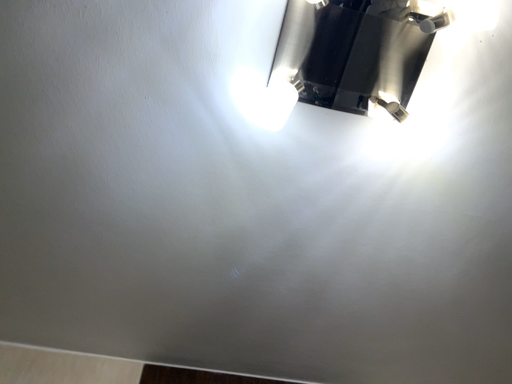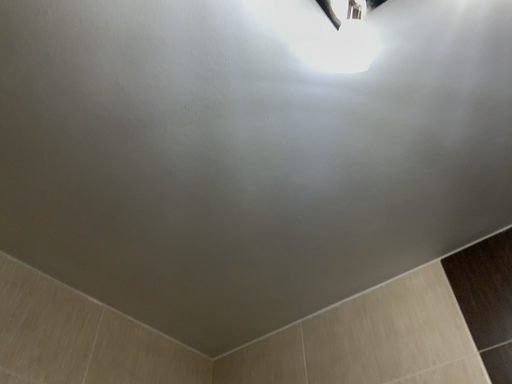
Question: How did the camera likely rotate when shooting the video?

Choices:
 (A) rotated upward
 (B) rotated downward

Answer: (B)